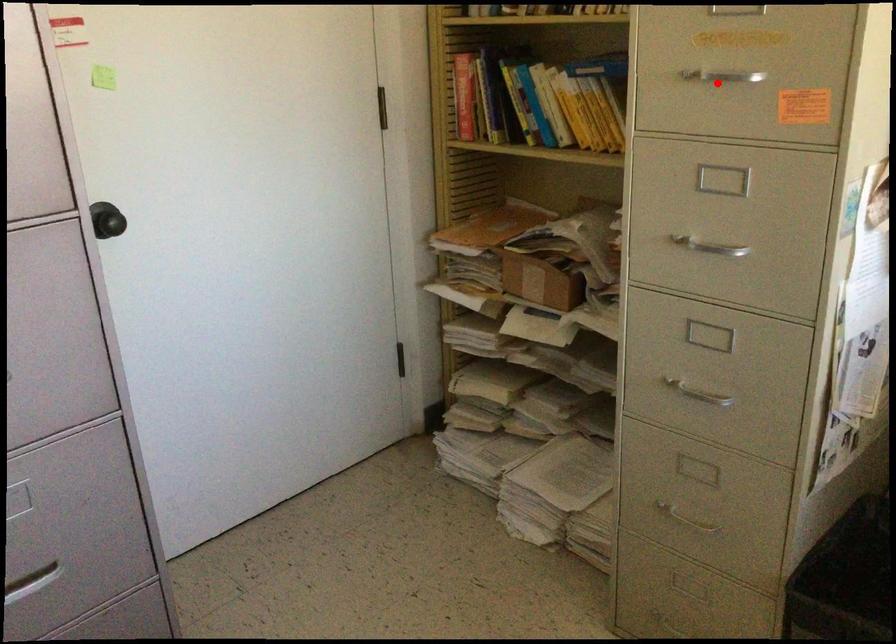
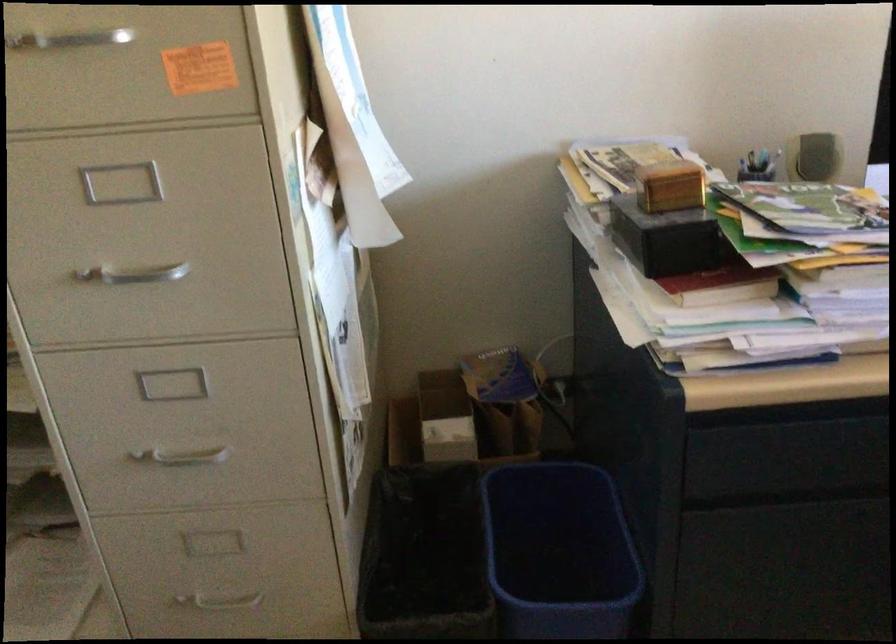
The point at the highlighted location is marked in the first image. Where is the corresponding point in the second image?

(67, 40)